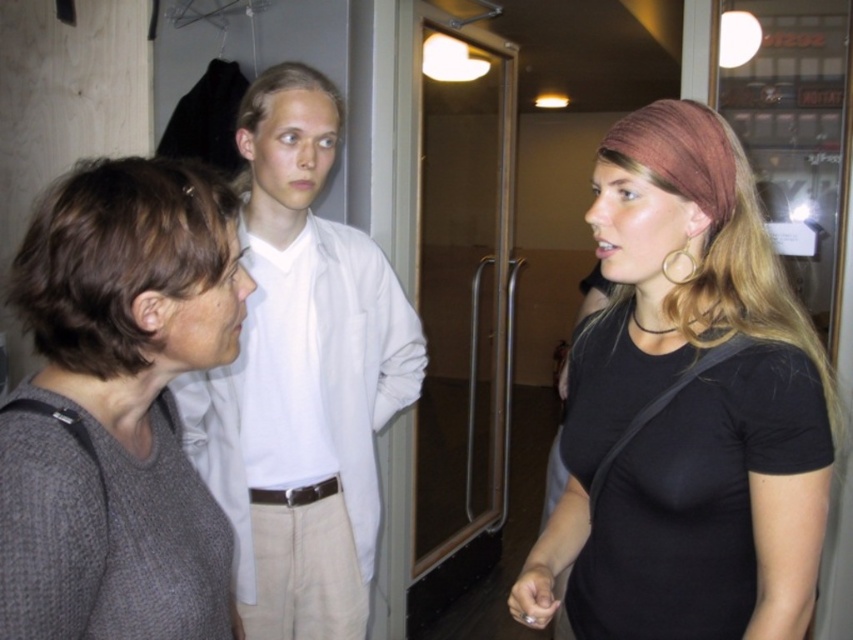
Question: Among these points, which one is farthest from the camera?

Choices:
 (A) (576, 560)
 (B) (259, 477)
 (C) (532, 624)
 (D) (492, 104)

Answer: (D)

Question: Does white matte shirt at center have a lesser width compared to dark brown hair at center?

Choices:
 (A) yes
 (B) no

Answer: (B)

Question: Where is black matte shirt at right located in relation to white matte shirt at center in the image?

Choices:
 (A) above
 (B) below

Answer: (A)

Question: Which is nearer to the matte black hand at lower center?

Choices:
 (A) white matte shirt at center
 (B) transparent glass door at center
 (C) dark brown hair at center
 (D) black matte shirt at right

Answer: (D)

Question: Among these objects, which one is nearest to the camera?

Choices:
 (A) transparent glass door at center
 (B) dark brown hair at center
 (C) white matte shirt at center

Answer: (B)

Question: Can you confirm if black matte shirt at right is wider than dark brown hair at center?

Choices:
 (A) no
 (B) yes

Answer: (B)